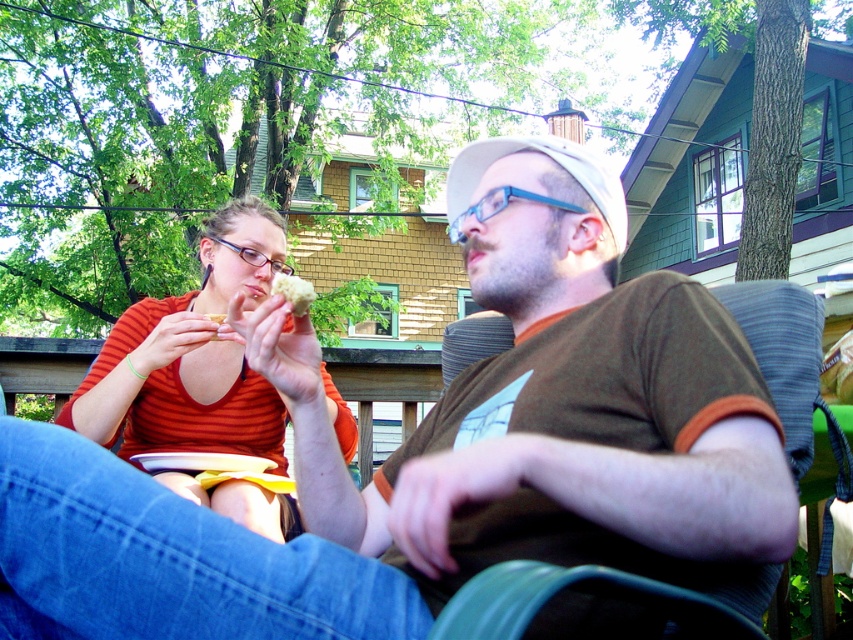
Question: Which object appears farthest from the camera in this image?

Choices:
 (A) orange striped shirt at upper left
 (B) white crumbly bread at center
 (C) yellow crumbly bread at upper center
 (D) brown cotton shirt at center

Answer: (C)

Question: Can you confirm if brown cotton shirt at center is positioned below yellow crumbly bread at upper center?

Choices:
 (A) no
 (B) yes

Answer: (B)

Question: From the image, what is the correct spatial relationship of white crumbly bread at center in relation to yellow crumbly bread at upper center?

Choices:
 (A) below
 (B) above

Answer: (B)

Question: Which object is the farthest from the yellow crumbly bread at upper center?

Choices:
 (A) brown cotton shirt at center
 (B) orange striped shirt at upper left

Answer: (A)

Question: Is brown cotton shirt at center to the right of yellow crumbly bread at upper center from the viewer's perspective?

Choices:
 (A) no
 (B) yes

Answer: (B)

Question: Which object is the farthest from the yellow crumbly bread at upper center?

Choices:
 (A) brown cotton shirt at center
 (B) orange striped shirt at upper left
 (C) white crumbly bread at center

Answer: (A)